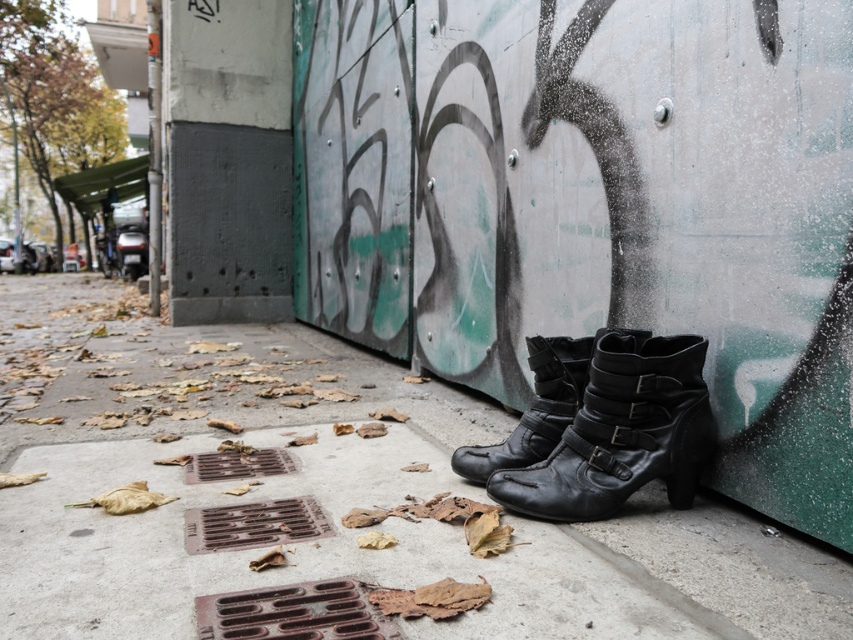
Question: Is black leather boots at lower right wider than black leather boots at center?

Choices:
 (A) no
 (B) yes

Answer: (B)

Question: Among these objects, which one is nearest to the camera?

Choices:
 (A) black leather boots at center
 (B) black leather boot at lower right
 (C) black leather boots at lower right

Answer: (B)

Question: Is black leather boots at lower right bigger than black leather boots at center?

Choices:
 (A) no
 (B) yes

Answer: (B)

Question: Estimate the real-world distances between objects in this image. Which object is closer to the black leather boot at lower right?

Choices:
 (A) black leather boots at center
 (B) black leather boots at lower right

Answer: (A)

Question: Is black leather boots at lower right closer to camera compared to black leather boot at lower right?

Choices:
 (A) yes
 (B) no

Answer: (B)

Question: Which of the following is the closest to the observer?

Choices:
 (A) black leather boots at center
 (B) black leather boots at lower right

Answer: (A)